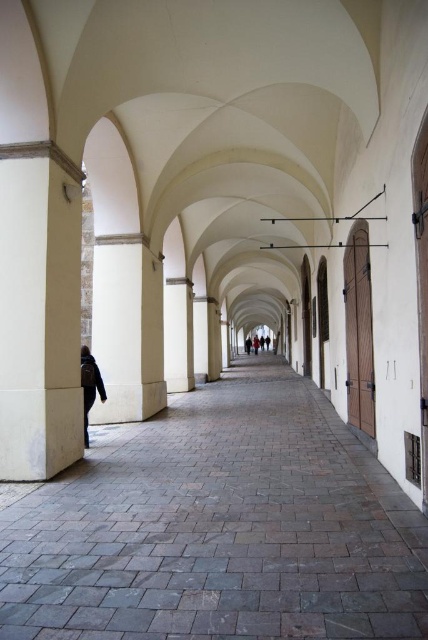
Which is behind, point (285, 636) or point (246, 348)?

The point (246, 348) is behind.

Can you confirm if gray stone path at center is shorter than light brown leather shoes at center?

Correct, gray stone path at center is not as tall as light brown leather shoes at center.

Does point (243, 496) come farther from viewer compared to point (258, 339)?

No, (243, 496) is closer to viewer.

Locate an element on the screen. The image size is (428, 640). gray stone path at center is located at coordinates (217, 528).

Looking at this image, is gray stone path at center wider than dark gray fabric jacket at center?

Indeed, gray stone path at center has a greater width compared to dark gray fabric jacket at center.

Can you confirm if gray stone path at center is bigger than dark gray fabric jacket at center?

Indeed, gray stone path at center has a larger size compared to dark gray fabric jacket at center.

Find the location of a particular element. gray stone path at center is located at coordinates coord(217,528).

Image resolution: width=428 pixels, height=640 pixels. What are the coordinates of `gray stone path at center` in the screenshot? It's located at (217, 528).

Is dark gray fabric jacket at center to the left of light brown leather shoes at center from the viewer's perspective?

Yes, dark gray fabric jacket at center is to the left of light brown leather shoes at center.

Describe the element at coordinates (89, 385) in the screenshot. This screenshot has height=640, width=428. I see `dark gray fabric jacket at center` at that location.

Image resolution: width=428 pixels, height=640 pixels. In order to click on dark gray fabric jacket at center in this screenshot , I will do `click(89, 385)`.